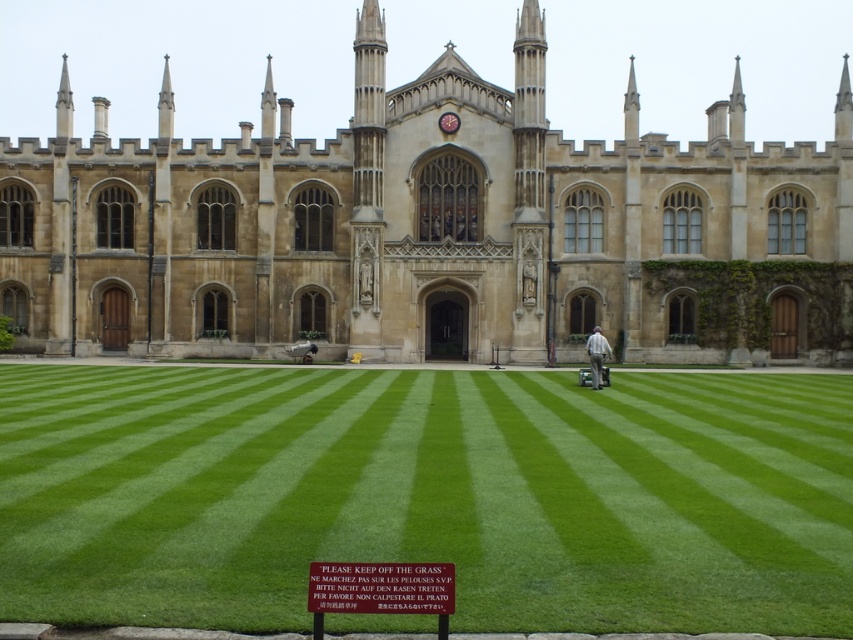
You are standing in front of the historic building and want to walk to the green smooth lawn at center. Which direction should you move relative to the building?

You should move forward towards the green smooth lawn at center, which is located at the center of the scene in front of the building.

You are a visitor standing in front of the historic building. You notice the brown stone gothic at center and the light gray fabric at center. Which object is bigger?

The brown stone gothic at center is larger in size than the light gray fabric at center.

You are a gardener planning to install a new pathway between the green smooth lawn at center and the light gray fabric at center. Which object has a greater width to accommodate the pathway?

The green smooth lawn at center has a greater width than the light gray fabric at center, so it can accommodate the pathway more effectively.